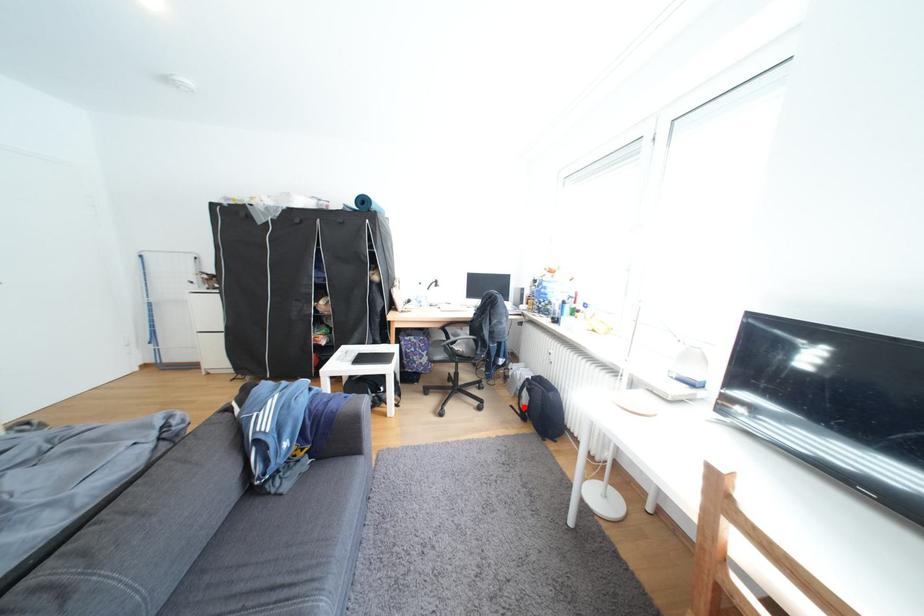
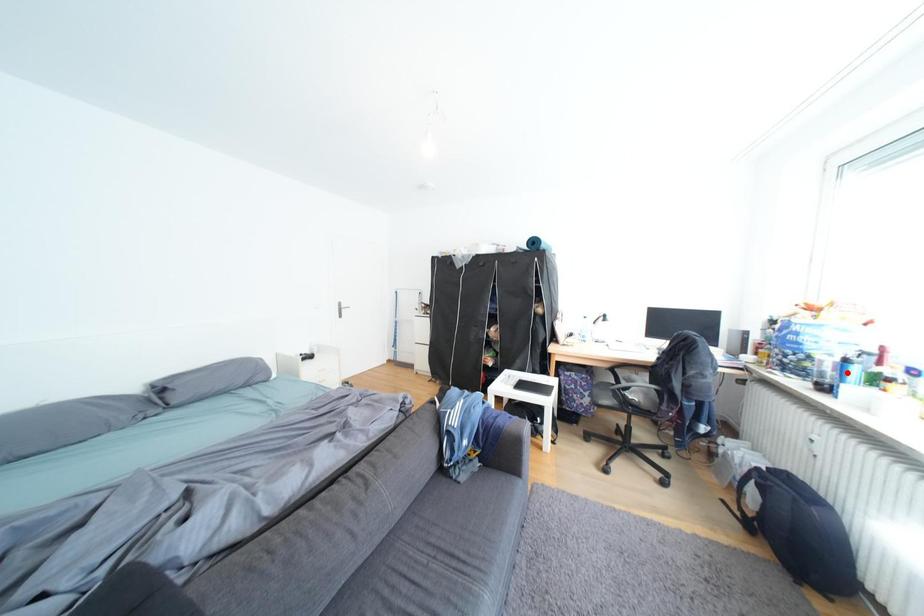
I am providing you with two images of the same scene from different viewpoints. A red point is marked on the first image and another point is marked on the second image. Are the points marked in image1 and image2 representing the same 3D position?

No